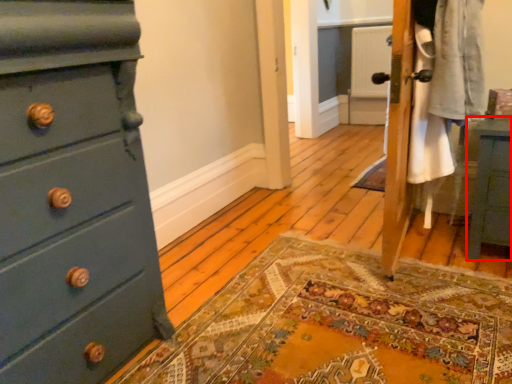
Question: In this image, where is nightstand (annotated by the red box) located relative to chest of drawers?

Choices:
 (A) right
 (B) left

Answer: (A)